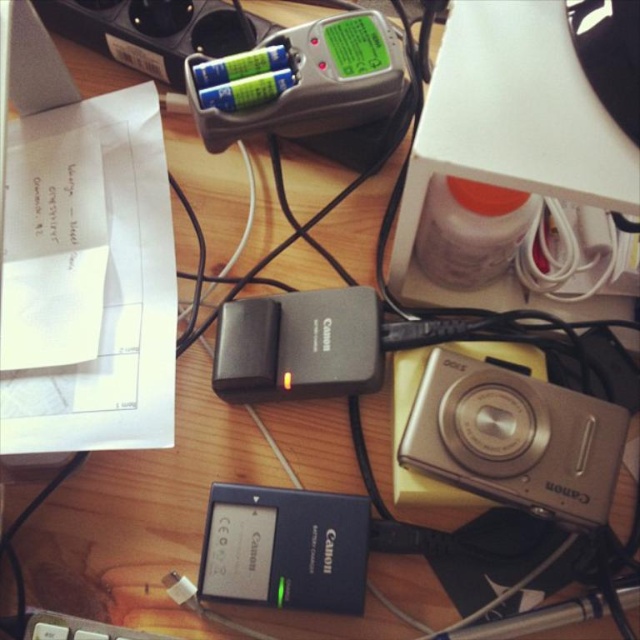
Question: Is black plastic battery charger at bottom positioned behind black plastic battery charger at center?

Choices:
 (A) yes
 (B) no

Answer: (B)

Question: Among these points, which one is nearest to the camera?

Choices:
 (A) (605, 516)
 (B) (298, 77)
 (C) (316, 340)

Answer: (A)

Question: Which point is closer to the camera?

Choices:
 (A) (554, 408)
 (B) (346, 538)

Answer: (B)

Question: Does black plastic battery charger at bottom appear over black plastic battery charger at center?

Choices:
 (A) yes
 (B) no

Answer: (B)

Question: Among these points, which one is nearest to the camera?

Choices:
 (A) (244, 136)
 (B) (349, 506)
 (C) (499, 365)
 (D) (228, 340)

Answer: (B)

Question: Can you confirm if silver metallic camera at lower right is wider than silver plastic battery charger at upper center?

Choices:
 (A) yes
 (B) no

Answer: (B)